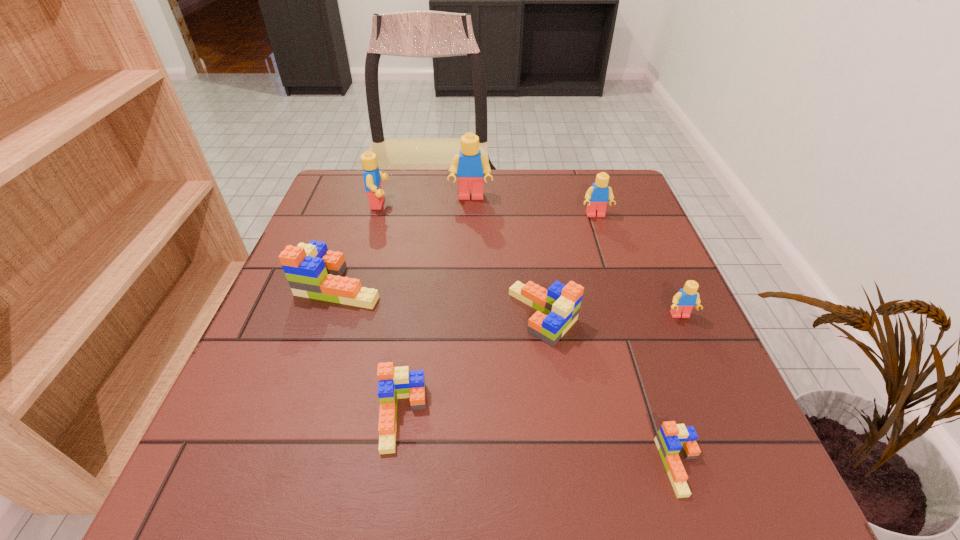
The height and width of the screenshot is (540, 960). Find the location of `empty space between the second orange Lego from left to right and the fifth object from right to left`. empty space between the second orange Lego from left to right and the fifth object from right to left is located at coordinates click(x=437, y=307).

Identify the location of vacant area that lies between the biggest orange Lego and the seventh shortest Lego. The image size is (960, 540). (360, 244).

This screenshot has width=960, height=540. I want to click on vacant space that's between the leftmost orange Lego and the rightmost orange Lego, so click(511, 375).

At what (x,y) coordinates should I click in order to perform the action: click on free area in between the second smallest orange Lego and the smallest orange Lego. Please return your answer as a coordinate pair (x, y). The height and width of the screenshot is (540, 960). Looking at the image, I should click on [x=541, y=442].

Where is `free area in between the rightmost Lego and the seventh tallest Lego`? free area in between the rightmost Lego and the seventh tallest Lego is located at coordinates (541, 367).

Locate an element on the screen. The image size is (960, 540). free spot between the second yellow Lego from right to left and the fourth object from right to left is located at coordinates (569, 265).

At what (x,y) coordinates should I click in order to perform the action: click on free spot between the third yellow Lego from right to left and the sixth object from right to left. Please return your answer as a coordinate pair (x, y). This screenshot has width=960, height=540. Looking at the image, I should click on (437, 307).

Find the location of a particular element. unoccupied area between the seventh shortest object and the second smallest yellow Lego is located at coordinates (488, 210).

Locate an element on the screen. The height and width of the screenshot is (540, 960). free space between the leftmost orange Lego and the third biggest yellow Lego is located at coordinates (468, 250).

This screenshot has height=540, width=960. I want to click on free spot between the third smallest yellow Lego and the biggest orange Lego, so click(x=360, y=244).